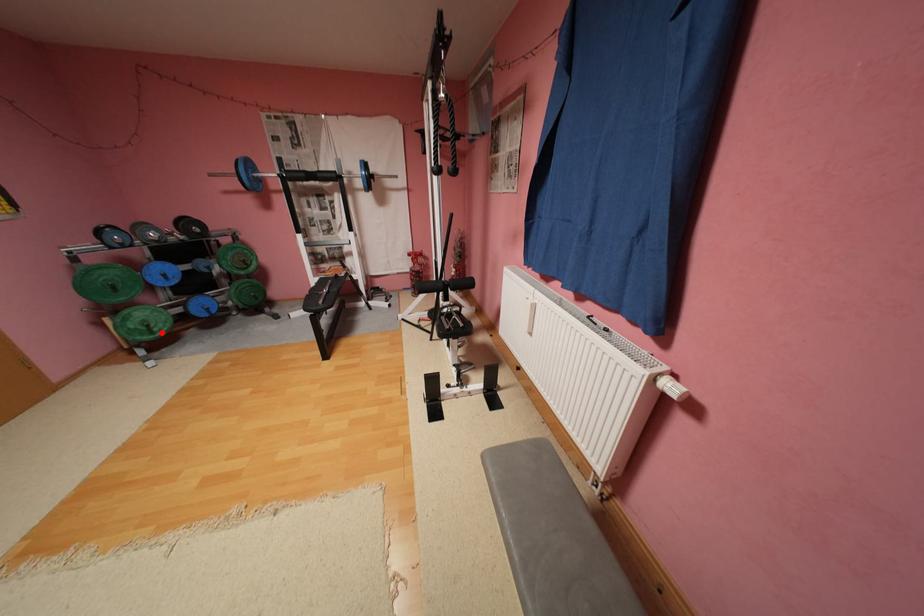
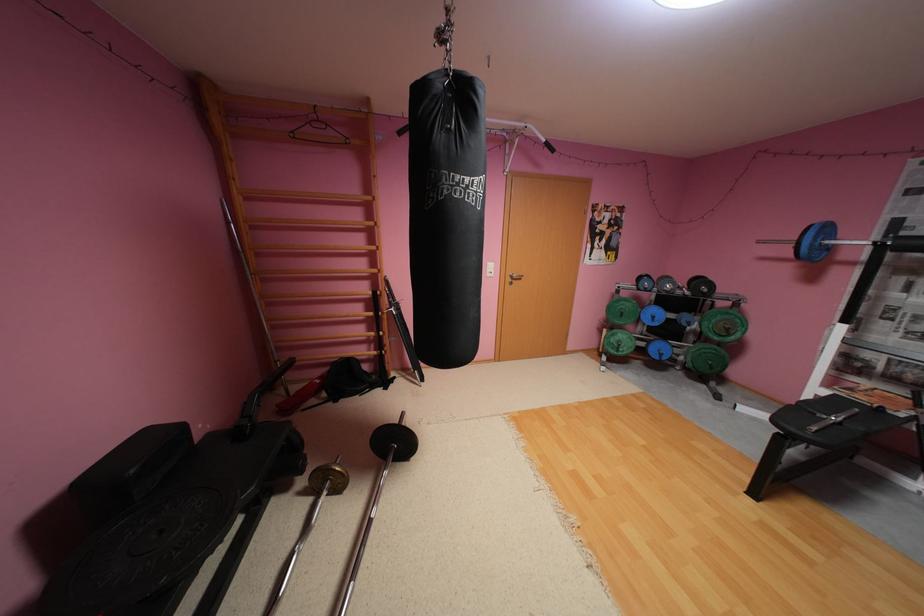
Locate, in the second image, the point that corresponds to the highlighted location in the first image.

(626, 351)